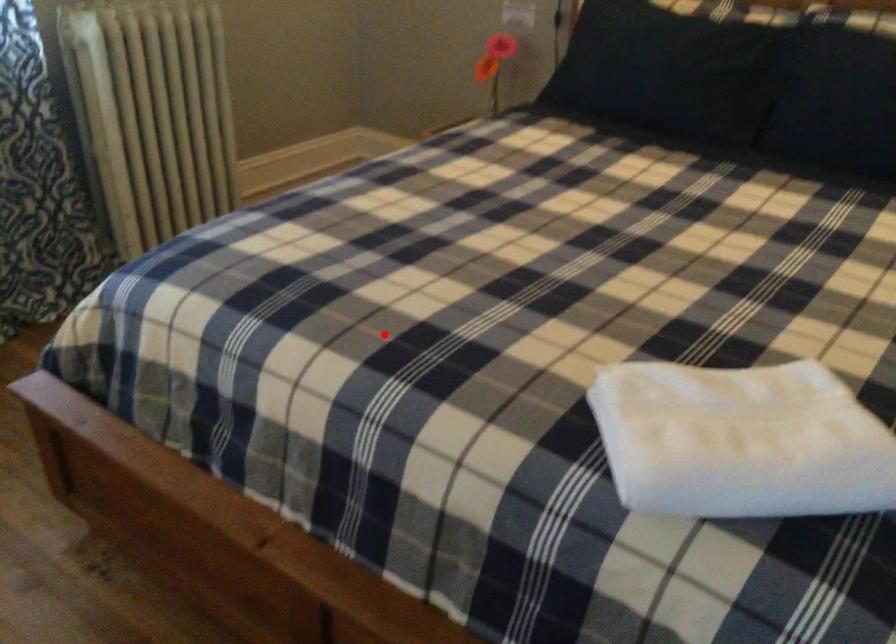
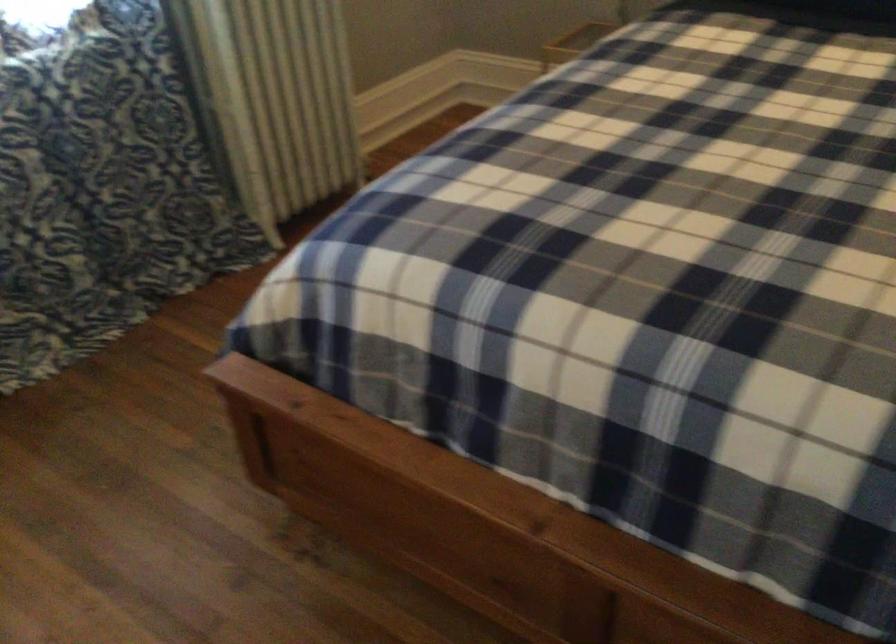
Find the pixel in the second image that matches the highlighted location in the first image.

(633, 279)